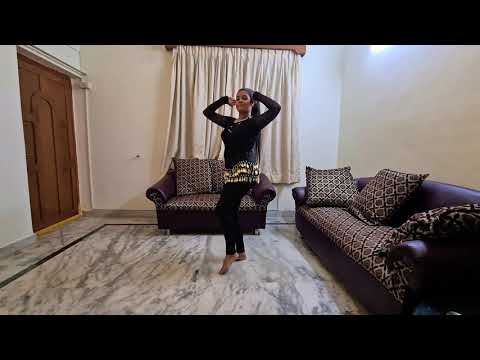
At what (x,y) coordinates should I click in order to perform the action: click on curtain hanger. Please return your answer as a coordinate pair (x, y). This screenshot has width=480, height=360. Looking at the image, I should click on (302, 47).